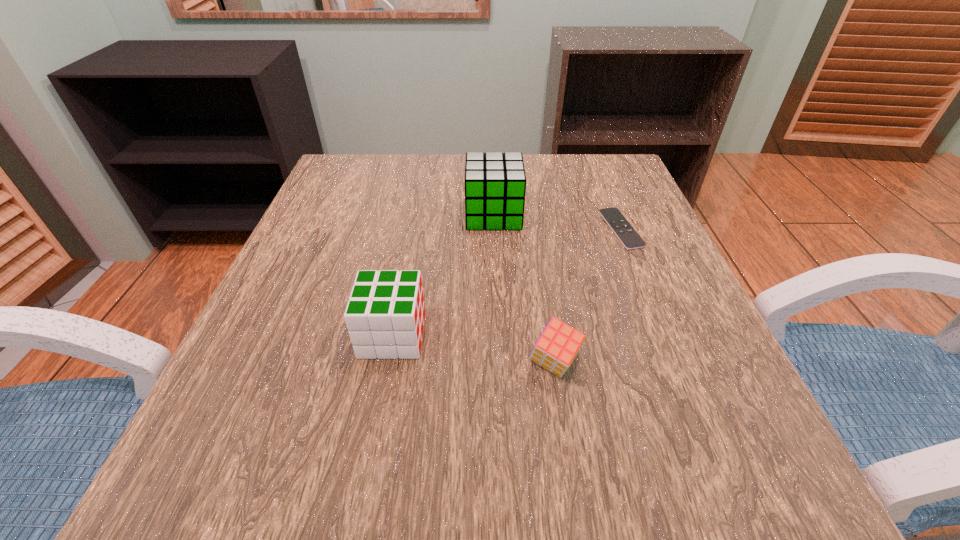
I want to click on free spot between the leftmost object and the rightmost object, so click(x=507, y=282).

What are the coordinates of `vacant space that is in between the tallest object and the shortest cube` in the screenshot? It's located at (524, 289).

You are a GUI agent. You are given a task and a screenshot of the screen. Output one action in this format:
    pyautogui.click(x=<x>, y=<y>)
    Task: Click on the unoccupied position between the rightmost object and the farthest cube
    
    Given the screenshot: What is the action you would take?
    pyautogui.click(x=557, y=222)

At what (x,y) coordinates should I click in order to perform the action: click on vacant region between the shortest cube and the remote control. Please return your answer as a coordinate pair (x, y). This screenshot has width=960, height=540. Looking at the image, I should click on (588, 296).

At what (x,y) coordinates should I click in order to perform the action: click on unoccupied area between the remote control and the tallest object. Please return your answer as a coordinate pair (x, y). Image resolution: width=960 pixels, height=540 pixels. Looking at the image, I should click on (557, 222).

This screenshot has width=960, height=540. I want to click on vacant point located between the third shortest object and the remote control, so click(x=507, y=282).

I want to click on vacant space that's between the shortest object and the tallest cube, so click(x=557, y=222).

At what (x,y) coordinates should I click in order to perform the action: click on free space between the tallest object and the rightmost object. Please return your answer as a coordinate pair (x, y). Image resolution: width=960 pixels, height=540 pixels. Looking at the image, I should click on (557, 222).

At what (x,y) coordinates should I click in order to perform the action: click on vacant space that is in between the leftmost object and the third tallest object. Please return your answer as a coordinate pair (x, y). The width and height of the screenshot is (960, 540). Looking at the image, I should click on (473, 349).

You are a GUI agent. You are given a task and a screenshot of the screen. Output one action in this format:
    pyautogui.click(x=<x>, y=<y>)
    Task: Click on the object that ranks as the third closest to the tallest object
    This screenshot has height=540, width=960.
    Given the screenshot: What is the action you would take?
    pyautogui.click(x=558, y=345)